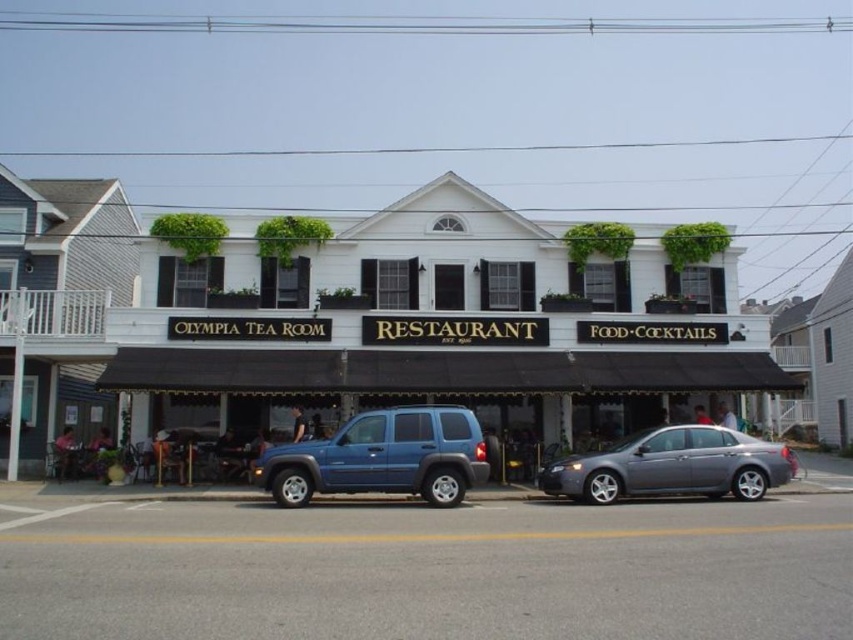
Can you confirm if blue matte suv at center is wider than metallic gray sedan at center?

In fact, blue matte suv at center might be narrower than metallic gray sedan at center.

The width and height of the screenshot is (853, 640). Describe the element at coordinates (381, 458) in the screenshot. I see `blue matte suv at center` at that location.

Where is `blue matte suv at center`? blue matte suv at center is located at coordinates (381, 458).